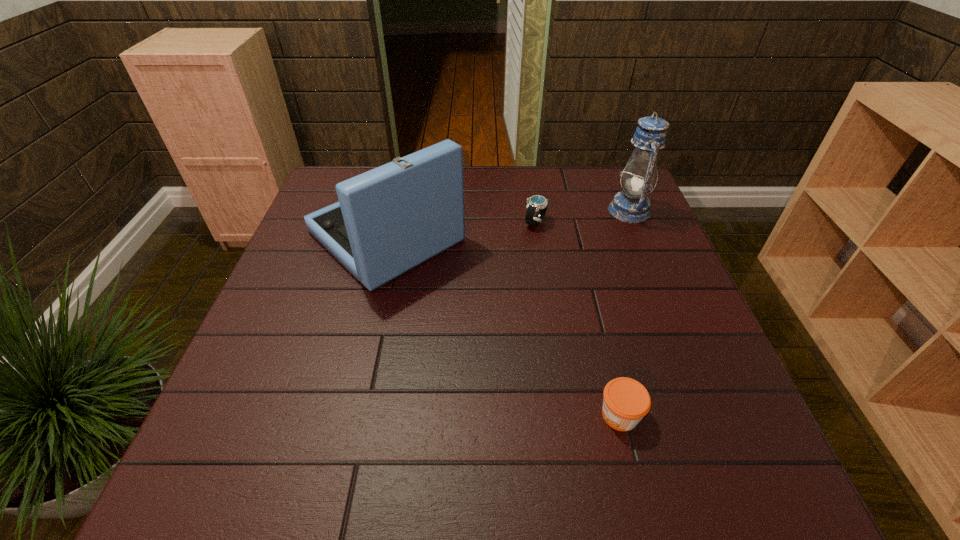
The image size is (960, 540). In the image, there is a desktop. Identify the location of free space at the near edge. (376, 453).

Image resolution: width=960 pixels, height=540 pixels. In the image, there is a desktop. Identify the location of vacant space at the right edge. (630, 241).

Where is `free space at the far left corner`? This screenshot has width=960, height=540. free space at the far left corner is located at coordinates (333, 165).

Find the location of a particular element. The height and width of the screenshot is (540, 960). vacant space at the far right corner of the desktop is located at coordinates (621, 171).

Locate an element on the screen. This screenshot has width=960, height=540. empty space between the watch and the lantern is located at coordinates (583, 217).

Where is `empty location between the second object from right to left and the watch`? empty location between the second object from right to left and the watch is located at coordinates (578, 319).

Find the location of a particular element. This screenshot has width=960, height=540. vacant space that's between the rightmost object and the third object from right to left is located at coordinates (583, 217).

The width and height of the screenshot is (960, 540). In order to click on empty space that is in between the third object from right to left and the nearest object in this screenshot , I will do `click(578, 319)`.

Find the location of a particular element. vacant region between the watch and the rightmost object is located at coordinates (583, 217).

Where is `unoccupied area between the third object from right to left and the lantern`? Image resolution: width=960 pixels, height=540 pixels. unoccupied area between the third object from right to left and the lantern is located at coordinates (583, 217).